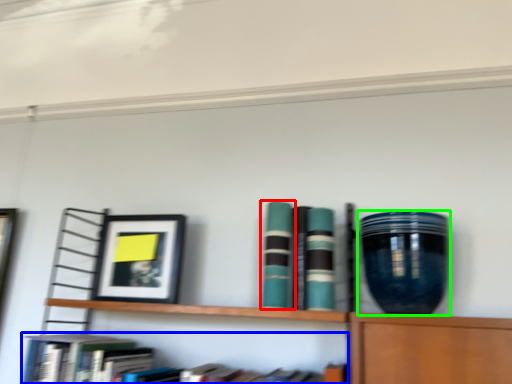
Question: Which object is positioned farthest from book (highlighted by a red box)? Select from book (highlighted by a blue box) and vase (highlighted by a green box).

Choices:
 (A) book
 (B) vase

Answer: (A)